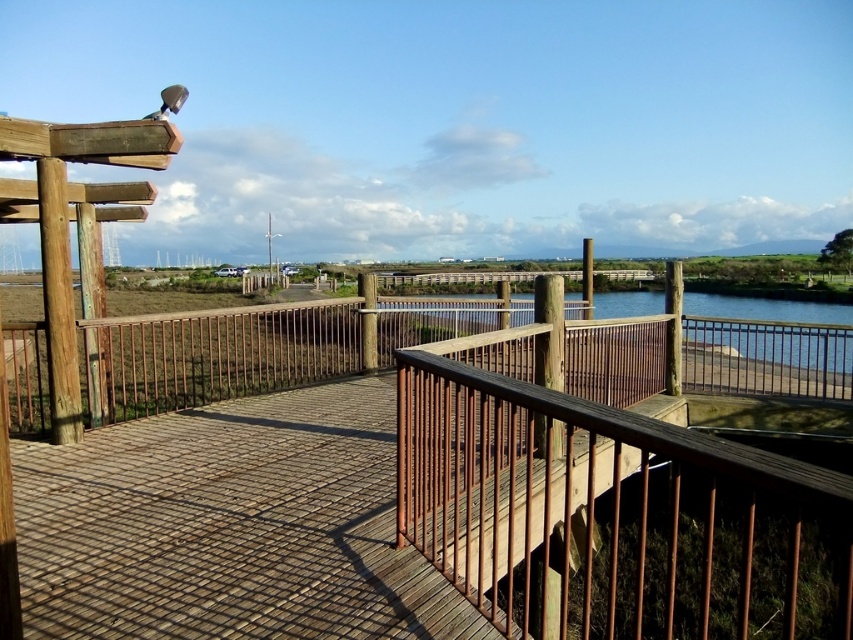
You are standing on the wooden deck and want to ensure safety while admiring the view. Considering the rustic wood railing at center and the clear blue water at center, which one is shorter in height?

The rustic wood railing at center is not as tall as the clear blue water at center, so the rustic wood railing at center is shorter in height.

You are standing on the wooden deck and want to reach the point marked by point (607, 502). Is there a railing at that location?

The point (607, 502) is where the rustic wood railing at center is located, so yes, there is a railing at that location.